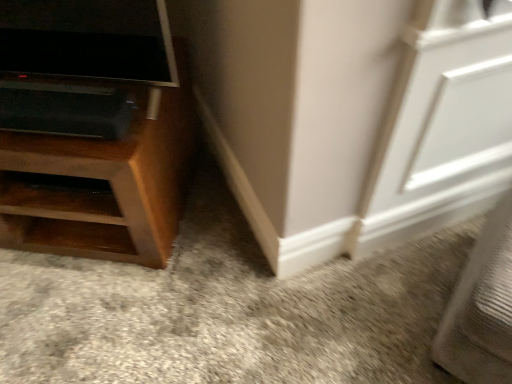
Question: Considering the positions of wooden cabinet at left and white matte screen door at upper right in the image, is wooden cabinet at left wider or thinner than white matte screen door at upper right?

Choices:
 (A) wide
 (B) thin

Answer: (A)

Question: From the image's perspective, relative to white matte screen door at upper right, is wooden cabinet at left above or below?

Choices:
 (A) below
 (B) above

Answer: (B)

Question: Visually, is wooden cabinet at left positioned to the left or to the right of white matte screen door at upper right?

Choices:
 (A) left
 (B) right

Answer: (A)

Question: From the image's perspective, is white matte screen door at upper right positioned above or below wooden cabinet at left?

Choices:
 (A) above
 (B) below

Answer: (B)

Question: In terms of height, does white matte screen door at upper right look taller or shorter compared to wooden cabinet at left?

Choices:
 (A) tall
 (B) short

Answer: (A)

Question: From a real-world perspective, is white matte screen door at upper right above or below wooden cabinet at left?

Choices:
 (A) below
 (B) above

Answer: (B)

Question: Would you say white matte screen door at upper right is to the left or to the right of wooden cabinet at left in the picture?

Choices:
 (A) right
 (B) left

Answer: (A)